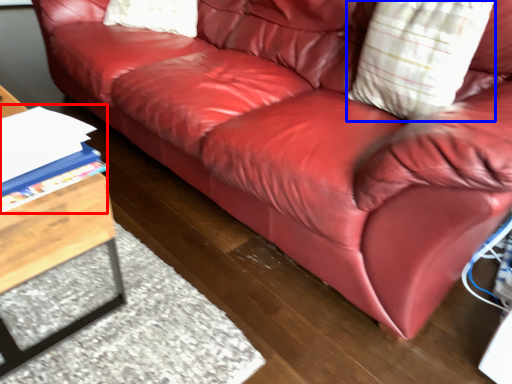
Question: Which object appears closest to the camera in this image, book (highlighted by a red box) or throw pillow (highlighted by a blue box)?

Choices:
 (A) book
 (B) throw pillow

Answer: (A)